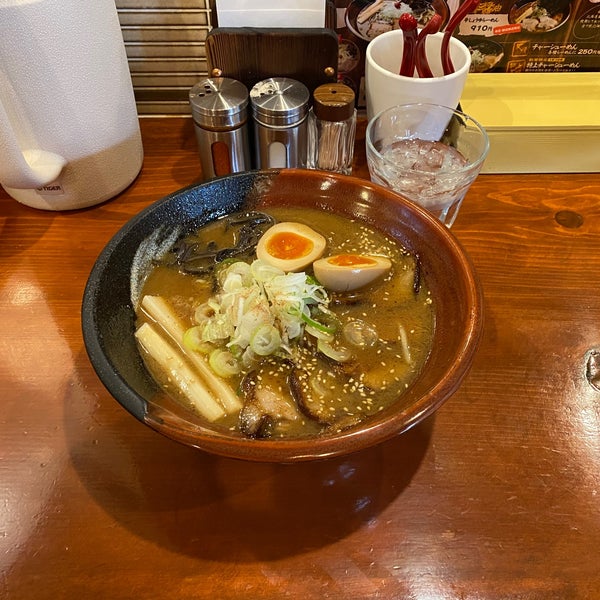
You are a GUI agent. You are given a task and a screenshot of the screen. Output one action in this format:
    pyautogui.click(x=<x>, y=<y>)
    Task: Click on the condiment shakers
    
    Given the screenshot: What is the action you would take?
    pyautogui.click(x=226, y=145), pyautogui.click(x=277, y=138), pyautogui.click(x=331, y=134)